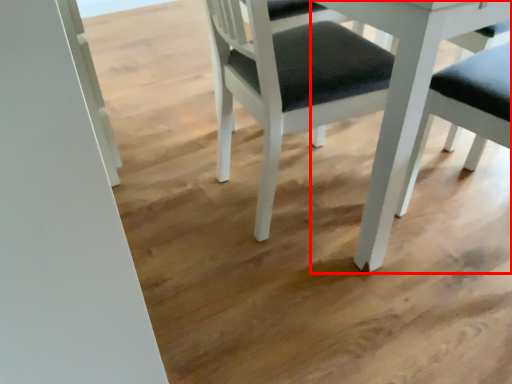
Question: From the image's perspective, where is table (annotated by the red box) located relative to chair?

Choices:
 (A) above
 (B) below

Answer: (A)